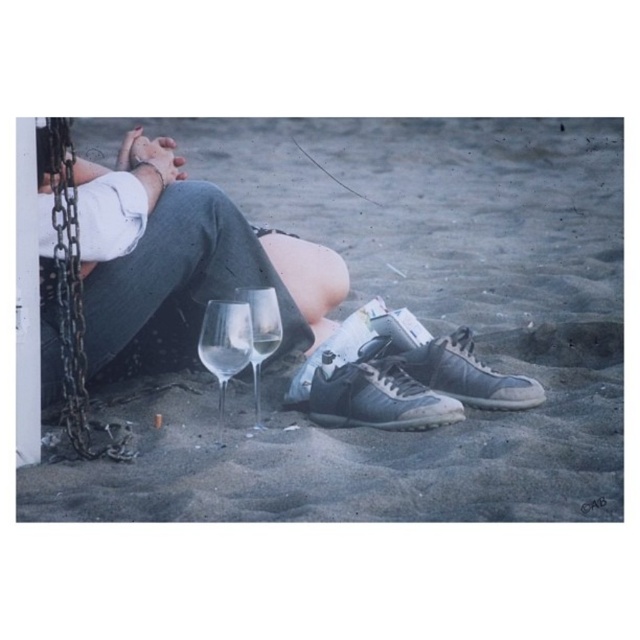
Can you confirm if leather sneakers at lower center is bigger than clear glass wine glass at lower center?

No, leather sneakers at lower center is not bigger than clear glass wine glass at lower center.

Can you confirm if leather sneakers at lower center is taller than clear glass wine glass at lower center?

No.

Is point (352, 384) less distant than point (252, 317)?

That is False.

Image resolution: width=640 pixels, height=640 pixels. I want to click on leather sneakers at lower center, so click(x=376, y=396).

Is matte black shoes at lower center above gray suede sneaker at lower center?

Yes, matte black shoes at lower center is above gray suede sneaker at lower center.

Does matte black shoes at lower center appear on the left side of gray suede sneaker at lower center?

Indeed, matte black shoes at lower center is positioned on the left side of gray suede sneaker at lower center.

Does point (180, 380) come in front of point (426, 369)?

No.

This screenshot has width=640, height=640. What are the coordinates of `matte black shoes at lower center` in the screenshot? It's located at (419, 317).

This screenshot has height=640, width=640. What do you see at coordinates (376, 396) in the screenshot? I see `leather sneakers at lower center` at bounding box center [376, 396].

Does leather sneakers at lower center have a larger size compared to gray suede sneaker at lower center?

Correct, leather sneakers at lower center is larger in size than gray suede sneaker at lower center.

Which is behind, point (378, 385) or point (403, 362)?

Positioned behind is point (403, 362).

At what (x,y) coordinates should I click in order to perform the action: click on leather sneakers at lower center. Please return your answer as a coordinate pair (x, y). The width and height of the screenshot is (640, 640). Looking at the image, I should click on (376, 396).